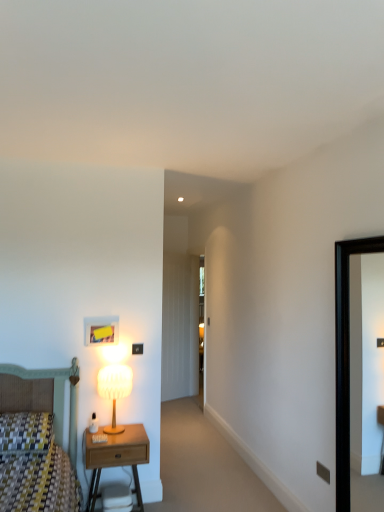
Where is `matte black electric outlet at lower right`? matte black electric outlet at lower right is located at coordinates (323, 472).

What do you see at coordinates (194, 293) in the screenshot? This screenshot has width=384, height=512. I see `transparent glass door at center` at bounding box center [194, 293].

Locate an element on the screen. This screenshot has width=384, height=512. matte black electric outlet at lower right is located at coordinates (323, 472).

Does point (346, 478) lie behind point (324, 477)?

No.

What are the coordinates of `electric outlet below the black glossy picture frame at right (from the image's perspective)` in the screenshot? It's located at (323, 472).

From a real-world perspective, is black glossy picture frame at right physically located above or below matte black electric outlet at lower right?

From a real-world perspective, black glossy picture frame at right is physically above matte black electric outlet at lower right.

Could you measure the distance between black glossy picture frame at right and matte black electric outlet at lower right?

23.05 inches.

Considering the sizes of objects matte black electric outlet at lower right and transparent glass door at center in the image provided, who is shorter, matte black electric outlet at lower right or transparent glass door at center?

With less height is matte black electric outlet at lower right.

I want to click on glass door on the left of the matte black electric outlet at lower right, so click(194, 293).

Are matte black electric outlet at lower right and transparent glass door at center far apart?

That's right, there is a large distance between matte black electric outlet at lower right and transparent glass door at center.

Is matte black electric outlet at lower right smaller than transparent glass door at center?

Yes.

How distant is matte black electric outlet at lower right from black glossy picture frame at right?

matte black electric outlet at lower right is 58.54 centimeters away from black glossy picture frame at right.

In the scene shown: Does matte black electric outlet at lower right have a smaller size compared to black glossy picture frame at right?

Yes.

Considering the relative sizes of matte black electric outlet at lower right and black glossy picture frame at right in the image provided, is matte black electric outlet at lower right wider than black glossy picture frame at right?

No, matte black electric outlet at lower right is not wider than black glossy picture frame at right.

From the image's perspective, is matte black electric outlet at lower right under black glossy picture frame at right?

Yes, from the image's perspective, matte black electric outlet at lower right is beneath black glossy picture frame at right.

Is there a large distance between matte black electric outlet at lower right and wooden nightstand at lower left?

Yes.

From the image's perspective, between matte black electric outlet at lower right and wooden nightstand at lower left, which one is located above?

matte black electric outlet at lower right appears higher in the image.

Would you say wooden nightstand at lower left is part of matte black electric outlet at lower right's contents?

No, wooden nightstand at lower left is not surrounded by matte black electric outlet at lower right.

Considering the relative sizes of matte black electric outlet at lower right and wooden nightstand at lower left in the image provided, is matte black electric outlet at lower right bigger than wooden nightstand at lower left?

No.

Is matte white lamp at left taller than black glossy picture frame at right?

Incorrect, the height of matte white lamp at left is not larger of that of black glossy picture frame at right.

Considering their positions, is matte white lamp at left located in front of or behind black glossy picture frame at right?

matte white lamp at left is behind black glossy picture frame at right.

Between matte white lamp at left and black glossy picture frame at right, which one appears on the right side from the viewer's perspective?

black glossy picture frame at right is more to the right.

Does matte white lamp at left have a larger size compared to black glossy picture frame at right?

Actually, matte white lamp at left might be smaller than black glossy picture frame at right.

Is matte white lamp at left placed right next to transparent glass door at center?

No, matte white lamp at left is not in contact with transparent glass door at center.

From the image's perspective, relative to transparent glass door at center, is matte white lamp at left above or below?

From the image's perspective, matte white lamp at left appears below transparent glass door at center.

Considering the sizes of objects matte white lamp at left and transparent glass door at center in the image provided, who is bigger, matte white lamp at left or transparent glass door at center?

Bigger between the two is transparent glass door at center.

Is matte white lamp at left located outside transparent glass door at center?

Yes, matte white lamp at left is outside of transparent glass door at center.

Could you tell me if black glossy picture frame at right is facing matte white lamp at left?

No, black glossy picture frame at right is not facing towards matte white lamp at left.

Is point (343, 327) closer to camera compared to point (109, 397)?

Yes.

Considering the relative sizes of black glossy picture frame at right and matte white lamp at left in the image provided, is black glossy picture frame at right smaller than matte white lamp at left?

Incorrect, black glossy picture frame at right is not smaller in size than matte white lamp at left.

From the image's perspective, which is below, black glossy picture frame at right or matte white lamp at left?

matte white lamp at left is shown below in the image.

Identify the location of electric outlet located on the left of black glossy picture frame at right. The width and height of the screenshot is (384, 512). (323, 472).

I want to click on glass door above the matte black electric outlet at lower right (from a real-world perspective), so click(x=194, y=293).

Considering their positions, is matte black electric outlet at lower right positioned further to black glossy picture frame at right than transparent glass door at center?

transparent glass door at center lies further to black glossy picture frame at right than the other object.

Based on their spatial positions, is black glossy picture frame at right or transparent glass door at center further from wooden nightstand at lower left?

Based on the image, transparent glass door at center appears to be further to wooden nightstand at lower left.

Looking at the image, which one is located closer to black glossy picture frame at right, matte white lamp at left or matte black electric outlet at lower right?

matte black electric outlet at lower right is closer to black glossy picture frame at right.

Based on their spatial positions, is matte black electric outlet at lower right or wooden nightstand at lower left closer to matte white lamp at left?

wooden nightstand at lower left.

Which object lies nearer to the anchor point transparent glass door at center, black glossy picture frame at right or wooden nightstand at lower left?

Based on the image, wooden nightstand at lower left appears to be nearer to transparent glass door at center.

When comparing their distances from transparent glass door at center, does matte black electric outlet at lower right or wooden nightstand at lower left seem closer?

wooden nightstand at lower left is closer to transparent glass door at center.

When comparing their distances from black glossy picture frame at right, does wooden nightstand at lower left or matte black electric outlet at lower right seem further?

wooden nightstand at lower left is further to black glossy picture frame at right.

From the image, which object appears to be farther from matte black electric outlet at lower right, black glossy picture frame at right or transparent glass door at center?

transparent glass door at center is positioned further to the anchor matte black electric outlet at lower right.

Identify the location of table lamp between matte black electric outlet at lower right and transparent glass door at center along the z-axis. (114, 389).

This screenshot has height=512, width=384. What are the coordinates of `nightstand situated between matte white lamp at left and black glossy picture frame at right from left to right` in the screenshot? It's located at (116, 458).

What are the coordinates of `electric outlet situated between matte white lamp at left and black glossy picture frame at right from left to right` in the screenshot? It's located at (323, 472).

This screenshot has width=384, height=512. I want to click on electric outlet between wooden nightstand at lower left and black glossy picture frame at right, so click(x=323, y=472).